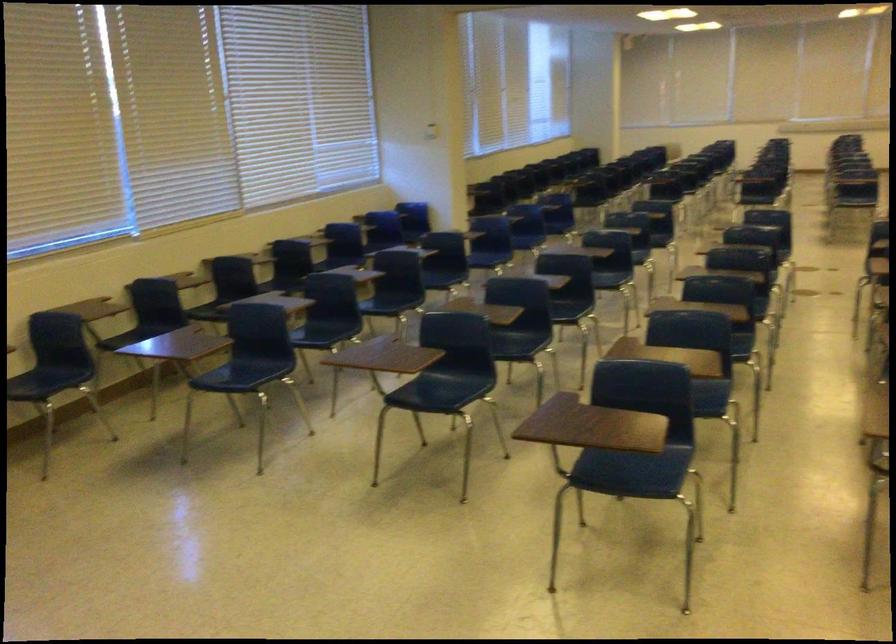
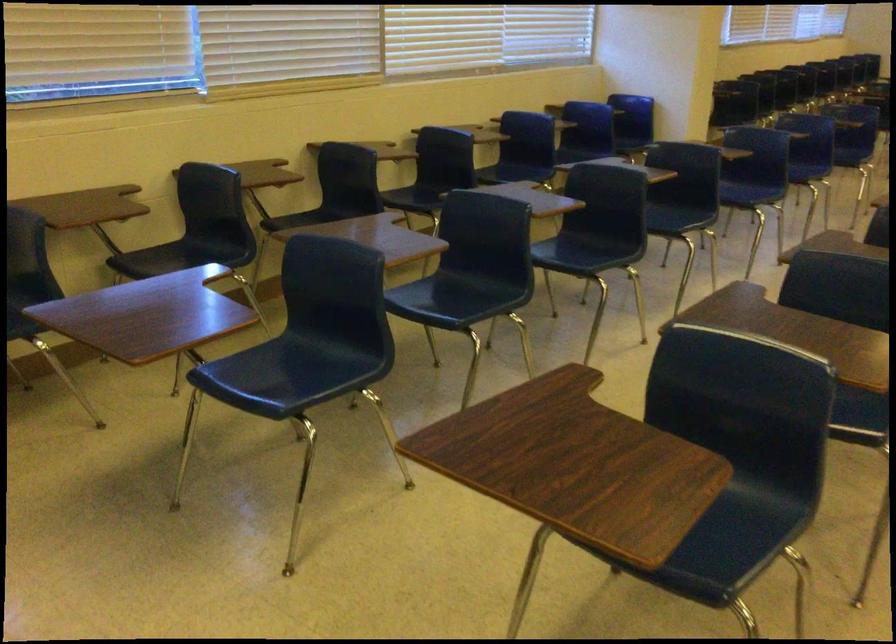
Find the pixel in the second image that matches pixel 234 375 in the first image.

(283, 375)